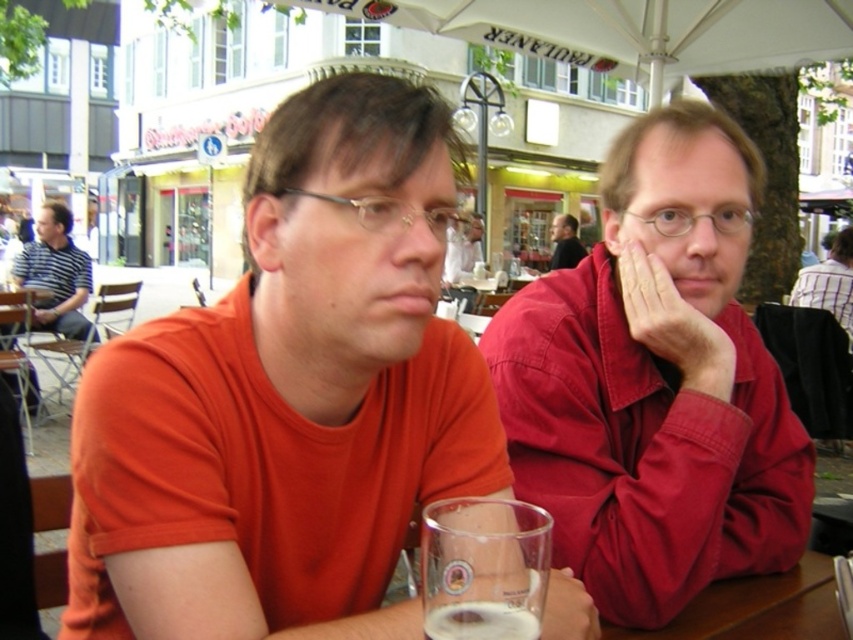
Question: Among these objects, which one is farthest from the camera?

Choices:
 (A) clear glass beer at lower center
 (B) striped cotton shirt at right
 (C) foamy glass at lower center

Answer: (B)

Question: Among these points, which one is farthest from the camera?

Choices:
 (A) (498, 614)
 (B) (532, 470)
 (C) (51, 282)

Answer: (C)

Question: Is clear glass beer at lower center to the left of striped cotton shirt at right from the viewer's perspective?

Choices:
 (A) yes
 (B) no

Answer: (A)

Question: Is striped cotton shirt at right in front of matte red shirt at center?

Choices:
 (A) no
 (B) yes

Answer: (B)

Question: Is striped cotton shirt at right bigger than translucent glass at lower center?

Choices:
 (A) yes
 (B) no

Answer: (A)

Question: Which object is farther from the camera taking this photo?

Choices:
 (A) striped cotton shirt at left
 (B) translucent glass at lower center
 (C) striped cotton shirt at right

Answer: (A)